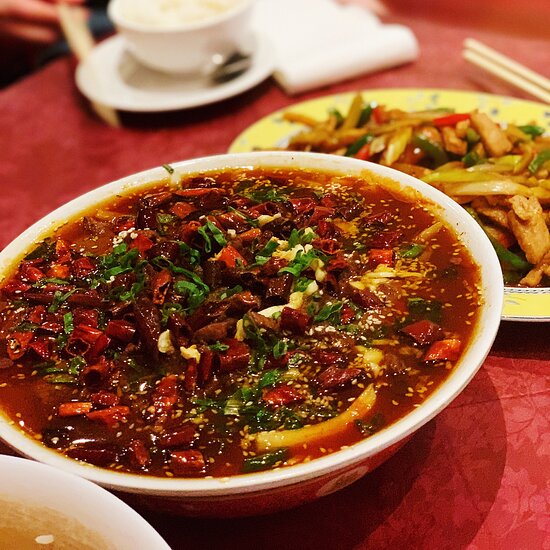
At what (x,y) coordinates should I click in order to perform the action: click on white rim of bowl. Please return your answer as a coordinate pair (x, y). The width and height of the screenshot is (550, 550). Looking at the image, I should click on (454, 380).